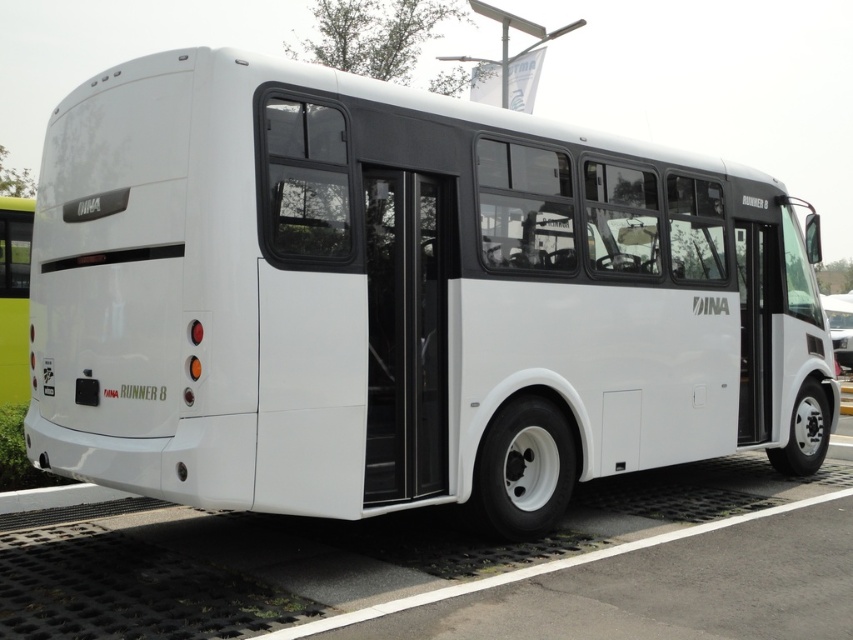
Who is lower down, white matte bus at center or white matte bus at right?

white matte bus at center is lower down.

Can you confirm if white matte bus at center is positioned below white matte bus at right?

Yes.

You are a GUI agent. You are given a task and a screenshot of the screen. Output one action in this format:
    pyautogui.click(x=<x>, y=<y>)
    Task: Click on the white matte bus at center
    The width and height of the screenshot is (853, 640).
    Given the screenshot: What is the action you would take?
    pyautogui.click(x=392, y=298)

Where is `white matte bus at center`? white matte bus at center is located at coordinates (392, 298).

Is white matte door at center shorter than white matte bus at right?

Indeed, white matte door at center has a lesser height compared to white matte bus at right.

Where is `white matte door at center`? Image resolution: width=853 pixels, height=640 pixels. white matte door at center is located at coordinates (753, 332).

This screenshot has width=853, height=640. I want to click on white matte door at center, so click(x=753, y=332).

Between transparent glass door at center and white matte bus at right, which one has more height?

With more height is white matte bus at right.

Can you confirm if transparent glass door at center is positioned below white matte bus at right?

Actually, transparent glass door at center is above white matte bus at right.

The width and height of the screenshot is (853, 640). Describe the element at coordinates (405, 332) in the screenshot. I see `transparent glass door at center` at that location.

The image size is (853, 640). Find the location of `transparent glass door at center`. transparent glass door at center is located at coordinates (405, 332).